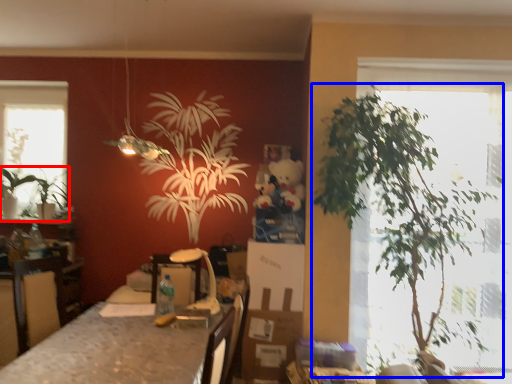
Question: Which point is closer to the camera, houseplant (highlighted by a red box) or houseplant (highlighted by a blue box)?

Choices:
 (A) houseplant
 (B) houseplant

Answer: (B)